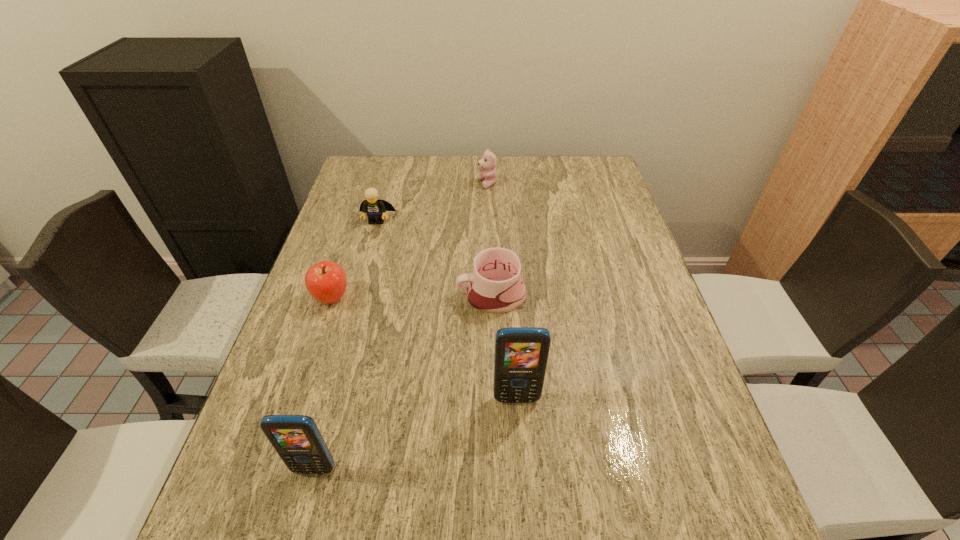
Identify which object is the third nearest to the apple. Please provide its 2D coordinates. Your answer should be formatted as a tuple, i.e. [(x, y)], where the tuple contains the x and y coordinates of a point satisfying the conditions above.

[(296, 438)]

Where is `vacant space that satisfies the following two spatial constraints: 1. at the face of the teddy bear; 2. on the front side of the apple`? This screenshot has width=960, height=540. vacant space that satisfies the following two spatial constraints: 1. at the face of the teddy bear; 2. on the front side of the apple is located at coordinates [x=490, y=298].